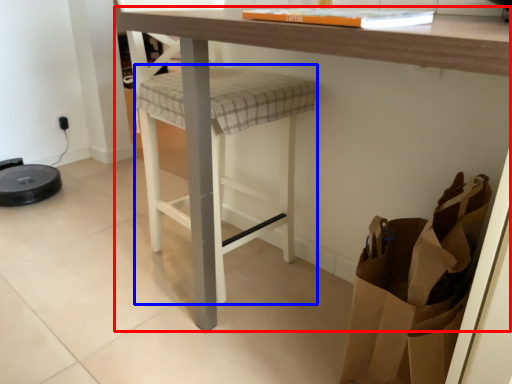
Question: Which point is further to the camera, table (highlighted by a red box) or step stool (highlighted by a blue box)?

Choices:
 (A) table
 (B) step stool

Answer: (B)